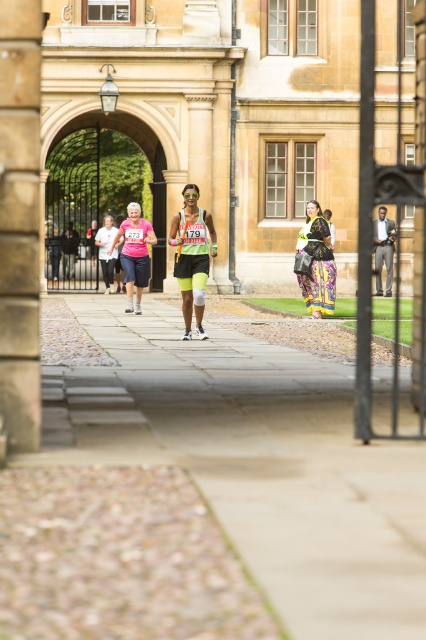
Question: Which object is the closest to the pebble stone pavement at center?

Choices:
 (A) matte black shorts at center
 (B) floral fabric dress at center
 (C) gray fabric jacket at center

Answer: (A)

Question: Which object is farther from the camera taking this photo?

Choices:
 (A) floral fabric dress at center
 (B) pebble stone pavement at center

Answer: (A)

Question: Which is farther from the matte black shorts at center?

Choices:
 (A) pink fabric shorts at center
 (B) pebble stone pavement at center
 (C) gray fabric jacket at center

Answer: (C)

Question: Is floral fabric dress at center positioned at the back of pink fabric shorts at center?

Choices:
 (A) yes
 (B) no

Answer: (B)

Question: Is pebble stone pavement at center wider than gray fabric jacket at center?

Choices:
 (A) no
 (B) yes

Answer: (A)

Question: Is matte black shorts at center positioned behind floral fabric dress at center?

Choices:
 (A) no
 (B) yes

Answer: (A)